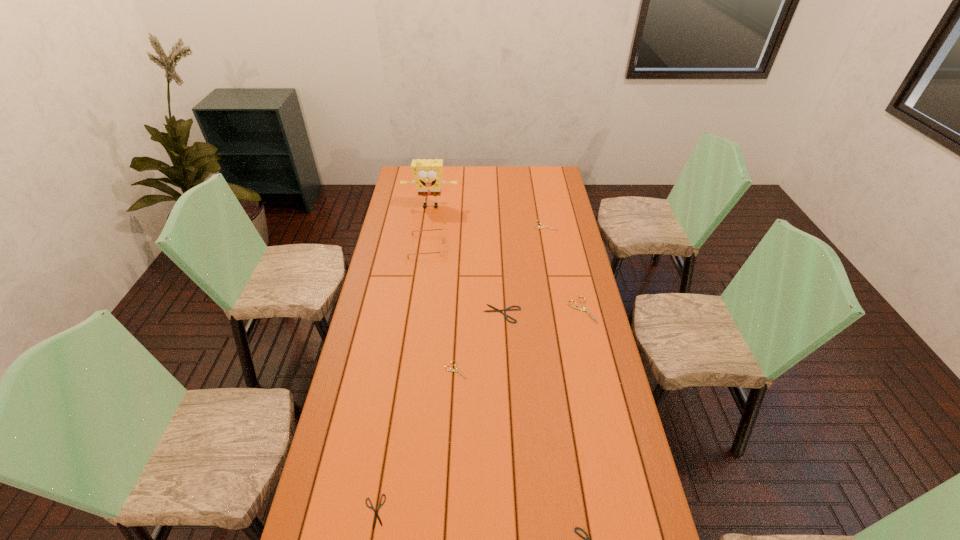
Locate an element on the screen. the third nearest shears is located at coordinates (452, 370).

Identify the location of the sixth farthest object. The image size is (960, 540). (452, 370).

Locate an element on the screen. The image size is (960, 540). the shortest object is located at coordinates (376, 516).

Where is `the leftmost shears`? The height and width of the screenshot is (540, 960). the leftmost shears is located at coordinates (376, 516).

The height and width of the screenshot is (540, 960). I want to click on vacant region located on the front-facing side of the sponge, so click(429, 219).

At what (x,y) coordinates should I click in order to perform the action: click on free location located on the front-facing side of the spectacles. Please return your answer as a coordinate pair (x, y). Looking at the image, I should click on (458, 246).

Find the location of a particular element. free space located on the front of the sixth shortest object is located at coordinates (588, 336).

Where is `vacant space located on the back of the farthest shears`? vacant space located on the back of the farthest shears is located at coordinates (543, 215).

Find the location of a particular element. This screenshot has width=960, height=540. vacant area situated on the front of the second black shears from right to left is located at coordinates (504, 344).

Locate an element on the screen. The height and width of the screenshot is (540, 960). free space located on the right of the leftmost beige shears is located at coordinates (563, 370).